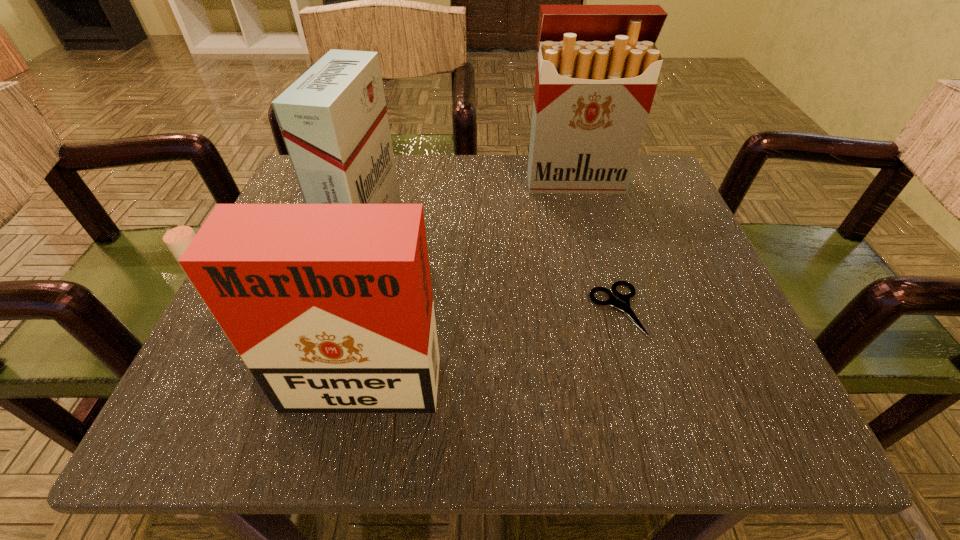
You are a GUI agent. You are given a task and a screenshot of the screen. Output one action in this format:
    pyautogui.click(x=<x>, y=<y>)
    Task: Click on the closest cigarette case to the rightmost cigarette case
    The image size is (960, 540).
    Given the screenshot: What is the action you would take?
    pyautogui.click(x=333, y=119)

Select which cigarette case is the closest to the second nearest object. Please provide its 2D coordinates. Your answer should be formatted as a tuple, i.e. [(x, y)], where the tuple contains the x and y coordinates of a point satisfying the conditions above.

[(330, 307)]

Image resolution: width=960 pixels, height=540 pixels. In order to click on vacant point that satisfies the following two spatial constraints: 1. with the lid open on the shortest object; 2. on the right side of the farthest object in this screenshot , I will do `click(609, 310)`.

You are a GUI agent. You are given a task and a screenshot of the screen. Output one action in this format:
    pyautogui.click(x=<x>, y=<y>)
    Task: Click on the free space that satisfies the following two spatial constraints: 1. with the lid open on the second nearest object; 2. on the right side of the farthest cigarette case
    This screenshot has height=540, width=960.
    Given the screenshot: What is the action you would take?
    pyautogui.click(x=609, y=310)